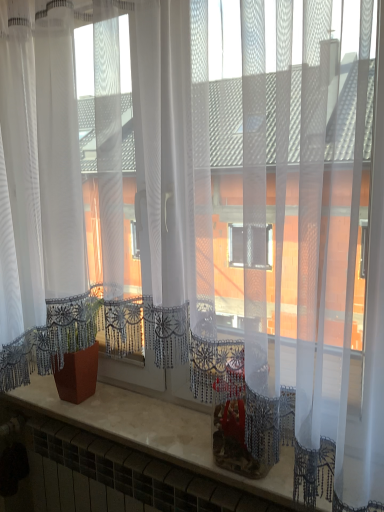
Question: Is matte terracotta pot at lower left bigger than marble counter top at center?

Choices:
 (A) no
 (B) yes

Answer: (A)

Question: Is matte terracotta pot at lower left to the left of marble counter top at center from the viewer's perspective?

Choices:
 (A) yes
 (B) no

Answer: (A)

Question: Is matte terracotta pot at lower left positioned beyond the bounds of marble counter top at center?

Choices:
 (A) no
 (B) yes

Answer: (B)

Question: Is marble counter top at center at the back of matte terracotta pot at lower left?

Choices:
 (A) no
 (B) yes

Answer: (A)

Question: Would you say matte terracotta pot at lower left contains marble counter top at center?

Choices:
 (A) yes
 (B) no

Answer: (B)

Question: Considering the relative sizes of matte terracotta pot at lower left and marble counter top at center in the image provided, is matte terracotta pot at lower left smaller than marble counter top at center?

Choices:
 (A) yes
 (B) no

Answer: (A)

Question: Does marble counter top at center have a greater height compared to matte terracotta pot at lower left?

Choices:
 (A) no
 (B) yes

Answer: (A)

Question: Is marble counter top at center not near matte terracotta pot at lower left?

Choices:
 (A) no
 (B) yes

Answer: (A)

Question: Is marble counter top at center thinner than matte terracotta pot at lower left?

Choices:
 (A) no
 (B) yes

Answer: (A)

Question: Is marble counter top at center closer to camera compared to matte terracotta pot at lower left?

Choices:
 (A) yes
 (B) no

Answer: (A)

Question: Can you confirm if marble counter top at center is bigger than matte terracotta pot at lower left?

Choices:
 (A) no
 (B) yes

Answer: (B)

Question: From a real-world perspective, is marble counter top at center positioned over matte terracotta pot at lower left based on gravity?

Choices:
 (A) yes
 (B) no

Answer: (B)

Question: Is matte terracotta pot at lower left situated inside marble counter top at center or outside?

Choices:
 (A) outside
 (B) inside

Answer: (A)